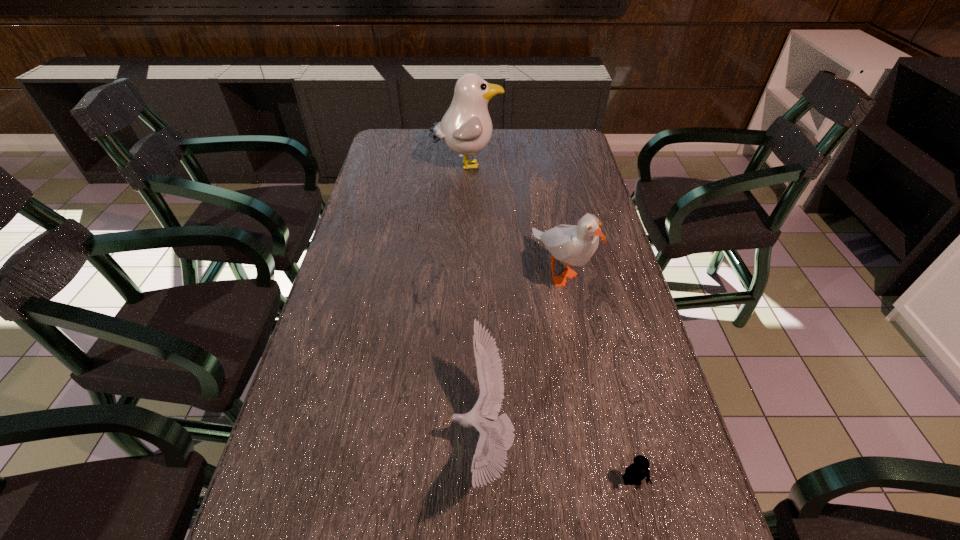
Find the location of a particular element. This screenshot has width=960, height=540. free space located at the tip of the beak of the second shortest object is located at coordinates (371, 437).

Where is `vacant space located at the tip of the beak of the second shortest object`? The width and height of the screenshot is (960, 540). vacant space located at the tip of the beak of the second shortest object is located at coordinates (300, 437).

Where is `object located in the far edge section of the desktop`? object located in the far edge section of the desktop is located at coordinates (466, 128).

Where is `gull that is at the right edge`? gull that is at the right edge is located at coordinates (575, 245).

What are the coordinates of `Lego at the right edge` in the screenshot? It's located at (637, 471).

This screenshot has width=960, height=540. I want to click on free space at the far edge of the desktop, so pyautogui.click(x=516, y=147).

Where is `vacant space at the left edge of the desktop`? vacant space at the left edge of the desktop is located at coordinates (328, 325).

The height and width of the screenshot is (540, 960). In the image, there is a desktop. What are the coordinates of `free space at the right edge` in the screenshot? It's located at (592, 172).

This screenshot has height=540, width=960. In order to click on unoccupied area between the second shortest object and the tallest gull in this screenshot , I will do point(474,301).

Locate an element on the screen. The height and width of the screenshot is (540, 960). free space between the tallest object and the second farthest object is located at coordinates (514, 218).